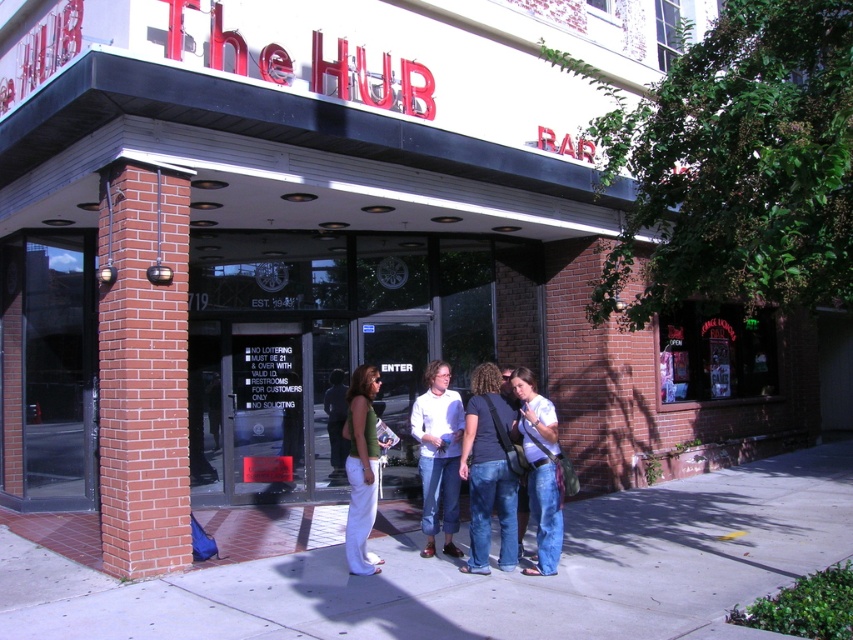
Question: Is white cotton shirt at center smaller than green jersey at center?

Choices:
 (A) yes
 (B) no

Answer: (B)

Question: Which point appears farthest from the camera in this image?

Choices:
 (A) (496, 497)
 (B) (641, 612)

Answer: (A)

Question: Does denim jeans at lower right have a lesser width compared to green jersey at center?

Choices:
 (A) yes
 (B) no

Answer: (B)

Question: Which object appears closest to the camera in this image?

Choices:
 (A) denim jeans at center
 (B) matte black pants at center
 (C) gray concrete sidewalk at center
 (D) green jersey at center

Answer: (C)

Question: Which is nearer to the denim jeans at center?

Choices:
 (A) denim jeans at lower right
 (B) green jersey at center
 (C) white cotton shirt at center
 (D) matte black pants at center

Answer: (A)

Question: Can you confirm if denim jeans at center is positioned above green jersey at center?

Choices:
 (A) yes
 (B) no

Answer: (A)